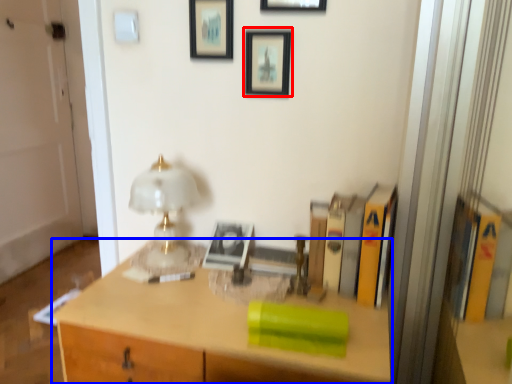
Question: Among these objects, which one is nearest to the camera, picture frame (highlighted by a red box) or desk (highlighted by a blue box)?

Choices:
 (A) picture frame
 (B) desk

Answer: (B)